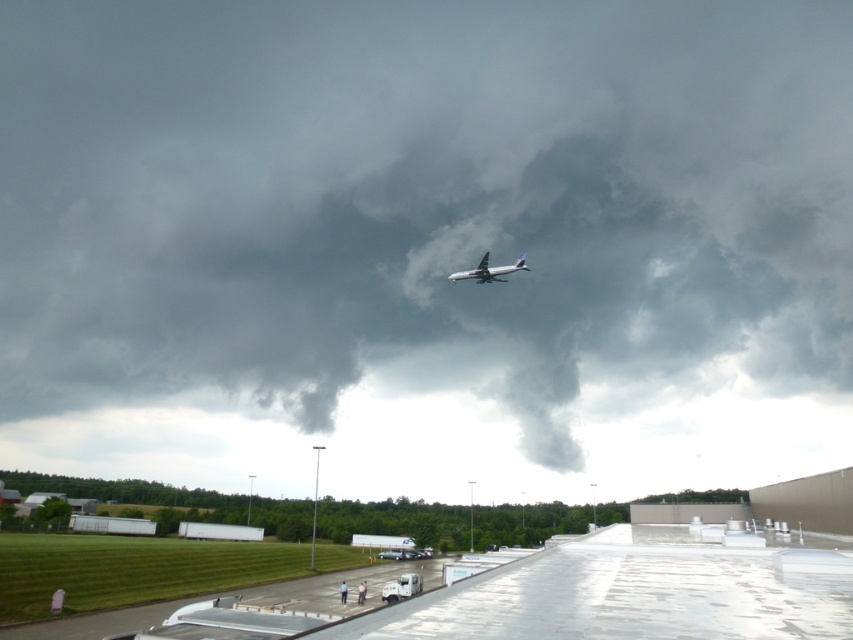
Is dark gray cloud at upper center wider than white glossy airplane at upper center?

Indeed, dark gray cloud at upper center has a greater width compared to white glossy airplane at upper center.

Consider the image. Who is positioned more to the left, dark gray cloud at upper center or white glossy airplane at upper center?

Positioned to the left is dark gray cloud at upper center.

The width and height of the screenshot is (853, 640). Find the location of `dark gray cloud at upper center`. dark gray cloud at upper center is located at coordinates (425, 236).